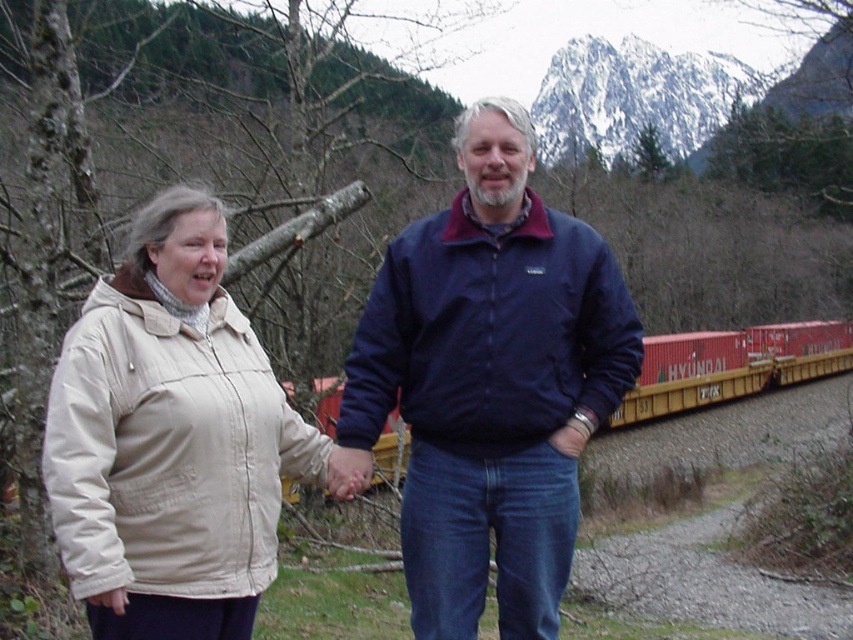
Question: Does navy blue jacket at center come behind red matte train car at right?

Choices:
 (A) yes
 (B) no

Answer: (B)

Question: Considering the relative positions of navy blue jacket at center and red matte train car at right in the image provided, where is navy blue jacket at center located with respect to red matte train car at right?

Choices:
 (A) left
 (B) right

Answer: (A)

Question: Which of the following is the farthest from the observer?

Choices:
 (A) beige fabric jacket at left
 (B) red matte train car at right

Answer: (B)

Question: Which point appears closest to the camera in this image?

Choices:
 (A) pyautogui.click(x=494, y=285)
 (B) pyautogui.click(x=140, y=568)
 (C) pyautogui.click(x=780, y=355)

Answer: (B)

Question: Which point is farther to the camera?

Choices:
 (A) (486, 276)
 (B) (229, 365)
 (C) (801, 380)

Answer: (C)

Question: In this image, where is navy blue jacket at center located relative to red matte train car at right?

Choices:
 (A) right
 (B) left

Answer: (B)